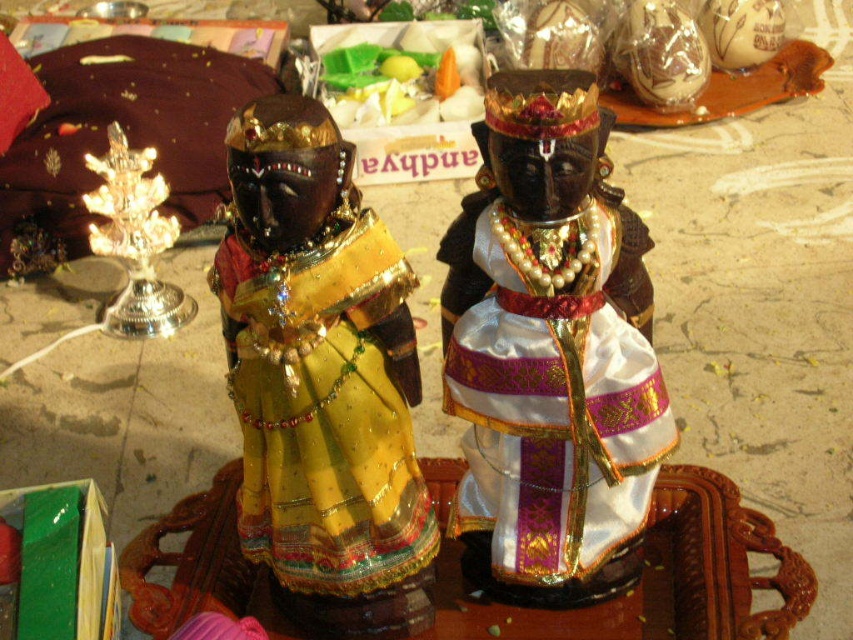
Based on the provided scene description, where is the metallic gold figurine at center located in terms of coordinates?

The metallic gold figurine at center is located at point coordinates of (321, 380).